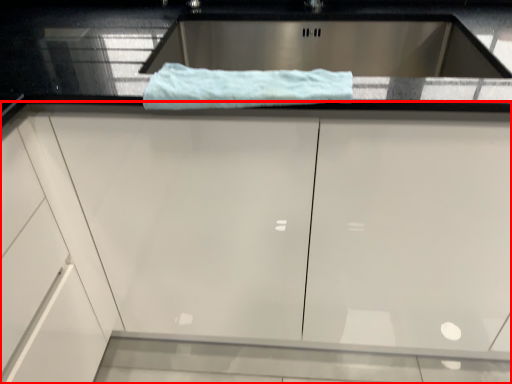
Question: From the image's perspective, what is the correct spatial relationship of cabinetry (annotated by the red box) in relation to bath towel?

Choices:
 (A) above
 (B) below

Answer: (B)